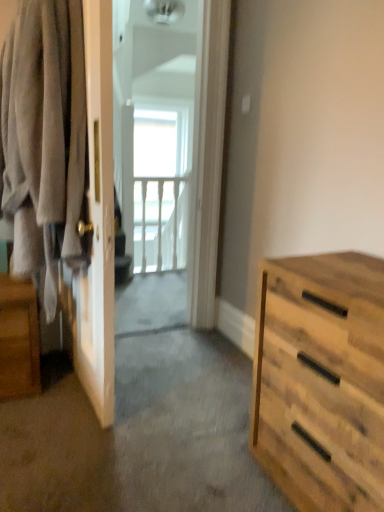
Question: Can you confirm if white wooden balustrade at upper center is taller than wooden nightstand at left?

Choices:
 (A) no
 (B) yes

Answer: (B)

Question: From the image's perspective, does white wooden balustrade at upper center appear lower than wooden nightstand at left?

Choices:
 (A) no
 (B) yes

Answer: (A)

Question: Is white wooden balustrade at upper center to the left of wooden nightstand at left from the viewer's perspective?

Choices:
 (A) no
 (B) yes

Answer: (A)

Question: Does white wooden balustrade at upper center appear on the right side of wooden nightstand at left?

Choices:
 (A) no
 (B) yes

Answer: (B)

Question: Can you confirm if white wooden balustrade at upper center is shorter than wooden nightstand at left?

Choices:
 (A) yes
 (B) no

Answer: (B)

Question: Is wooden nightstand at left in front of or behind natural wood dresser at right in the image?

Choices:
 (A) behind
 (B) front

Answer: (A)

Question: Considering the positions of wooden nightstand at left and natural wood dresser at right in the image, is wooden nightstand at left bigger or smaller than natural wood dresser at right?

Choices:
 (A) small
 (B) big

Answer: (A)

Question: Is wooden nightstand at left spatially inside natural wood dresser at right, or outside of it?

Choices:
 (A) outside
 (B) inside

Answer: (A)

Question: Looking at their shapes, would you say wooden nightstand at left is wider or thinner than natural wood dresser at right?

Choices:
 (A) thin
 (B) wide

Answer: (A)

Question: Choose the correct answer: Is natural wood dresser at right inside white glossy screen door at center or outside it?

Choices:
 (A) inside
 (B) outside

Answer: (B)

Question: From the image's perspective, is natural wood dresser at right positioned above or below white glossy screen door at center?

Choices:
 (A) above
 (B) below

Answer: (B)

Question: Is point (372, 398) positioned closer to the camera than point (137, 96)?

Choices:
 (A) farther
 (B) closer

Answer: (B)

Question: From a real-world perspective, is natural wood dresser at right positioned above or below white glossy screen door at center?

Choices:
 (A) above
 (B) below

Answer: (B)

Question: From a real-world perspective, is soft gray fabric at left positioned above or below wooden nightstand at left?

Choices:
 (A) above
 (B) below

Answer: (A)

Question: In the image, is soft gray fabric at left positioned in front of or behind wooden nightstand at left?

Choices:
 (A) front
 (B) behind

Answer: (A)